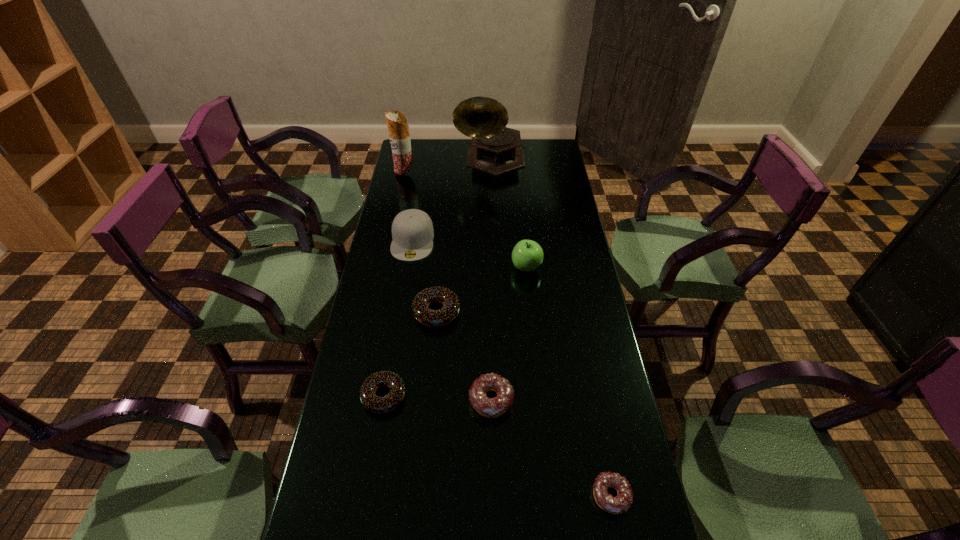
This screenshot has width=960, height=540. Find the location of `vacant region at the far right corner of the desktop`. vacant region at the far right corner of the desktop is located at coordinates (543, 153).

Image resolution: width=960 pixels, height=540 pixels. What are the coordinates of `free space between the phonograph record and the nearer chocolate doughnut` in the screenshot? It's located at (438, 278).

At what (x,y) coordinates should I click in order to perform the action: click on free space between the smaller chocolate doughnut and the farther pink doughnut. Please return your answer as a coordinate pair (x, y). Image resolution: width=960 pixels, height=540 pixels. Looking at the image, I should click on (438, 397).

I want to click on free space between the farther pink doughnut and the nearer pink doughnut, so click(x=551, y=448).

Locate an element on the screen. The height and width of the screenshot is (540, 960). free spot between the gray cap and the nearer chocolate doughnut is located at coordinates (398, 318).

In order to click on free area in between the sixth shortest object and the bigger chocolate doughnut in this screenshot , I will do `click(482, 290)`.

Identify the location of free space between the nearer pink doughnut and the nearer chocolate doughnut. Image resolution: width=960 pixels, height=540 pixels. (497, 446).

The height and width of the screenshot is (540, 960). I want to click on empty location between the phonograph record and the bigger chocolate doughnut, so click(464, 236).

At what (x,y) coordinates should I click in order to perform the action: click on empty location between the nearer chocolate doughnut and the left pink doughnut. Please return your answer as a coordinate pair (x, y). The width and height of the screenshot is (960, 540). Looking at the image, I should click on (438, 397).

Identify which object is the third closest to the farthest doughnut. Please provide its 2D coordinates. Your answer should be formatted as a tuple, i.e. [(x, y)], where the tuple contains the x and y coordinates of a point satisfying the conditions above.

[(488, 407)]